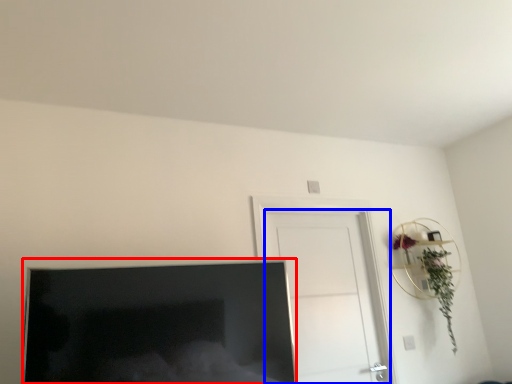
Question: Which of the following is the closest to the observer, television (highlighted by a red box) or door (highlighted by a blue box)?

Choices:
 (A) television
 (B) door

Answer: (A)